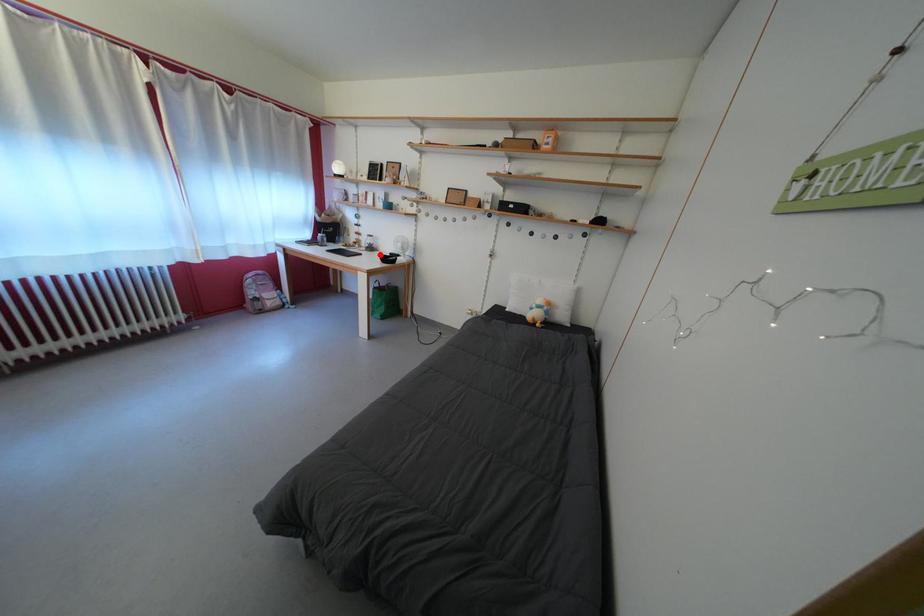
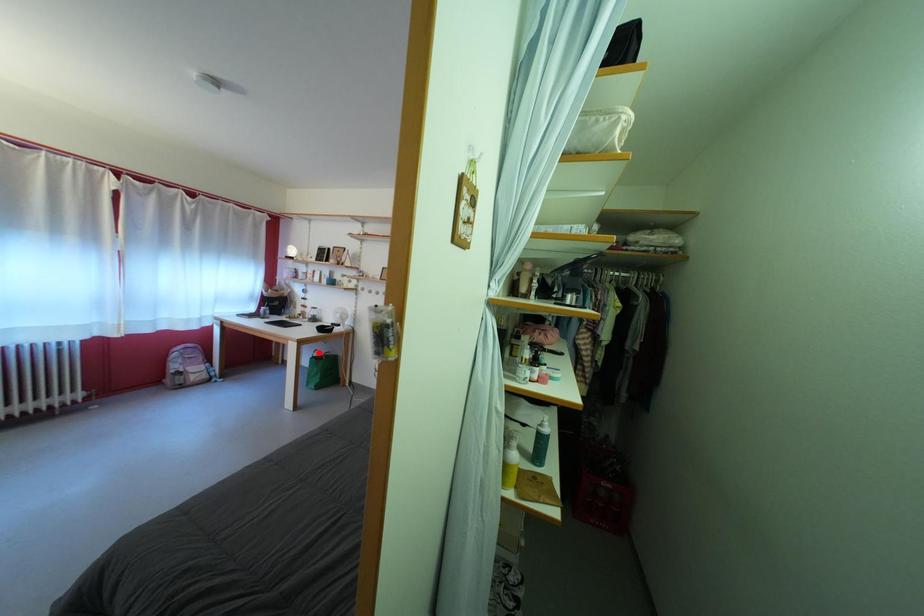
I am providing you with two images of the same scene from different viewpoints. A red point is marked on the first image and another point is marked on the second image. Are the points marked in image1 and image2 representing the same 3D position?

No